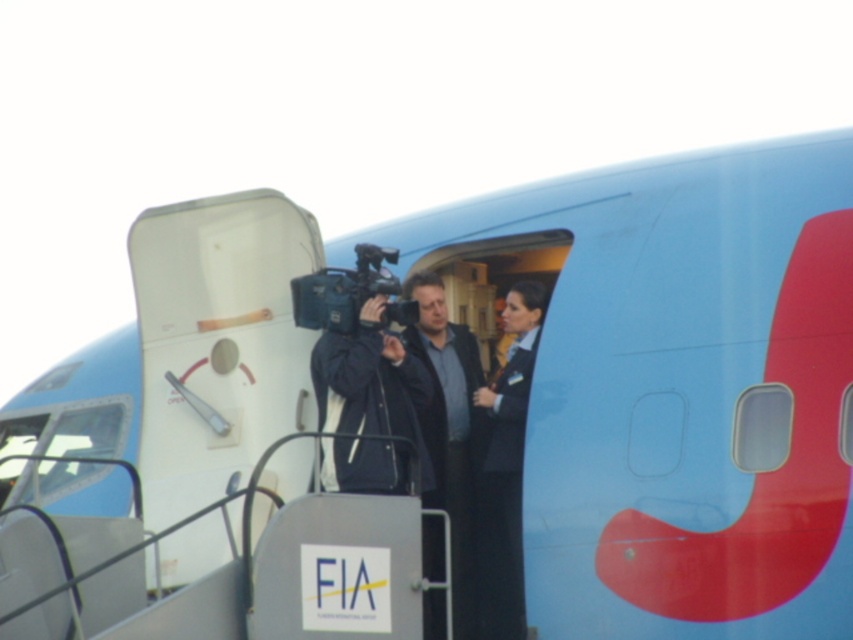
Can you confirm if dark blue fabric jacket at center is wider than black fabric uniform at center?

Indeed, dark blue fabric jacket at center has a greater width compared to black fabric uniform at center.

Can you confirm if dark blue fabric jacket at center is shorter than black fabric uniform at center?

Correct, dark blue fabric jacket at center is not as tall as black fabric uniform at center.

Is point (438, 348) more distant than point (506, 625)?

Yes, it is.

Locate an element on the screen. This screenshot has width=853, height=640. dark blue fabric jacket at center is located at coordinates (450, 429).

Which of these two, black fabric uniform at center or matte black video camera at center, stands shorter?

With less height is matte black video camera at center.

Does black fabric uniform at center appear on the left side of matte black video camera at center?

No, black fabric uniform at center is not to the left of matte black video camera at center.

Is point (520, 321) positioned after point (390, 250)?

Yes, it is behind point (390, 250).

The width and height of the screenshot is (853, 640). Find the location of `black fabric uniform at center`. black fabric uniform at center is located at coordinates (508, 467).

The width and height of the screenshot is (853, 640). What do you see at coordinates (450, 429) in the screenshot?
I see `dark blue fabric jacket at center` at bounding box center [450, 429].

Is dark blue fabric jacket at center in front of matte black video camera at center?

Yes, it is in front of matte black video camera at center.

Is point (416, 273) farther from viewer compared to point (329, 321)?

Yes, it is behind point (329, 321).

Where is `dark blue fabric jacket at center`? This screenshot has width=853, height=640. dark blue fabric jacket at center is located at coordinates (450, 429).